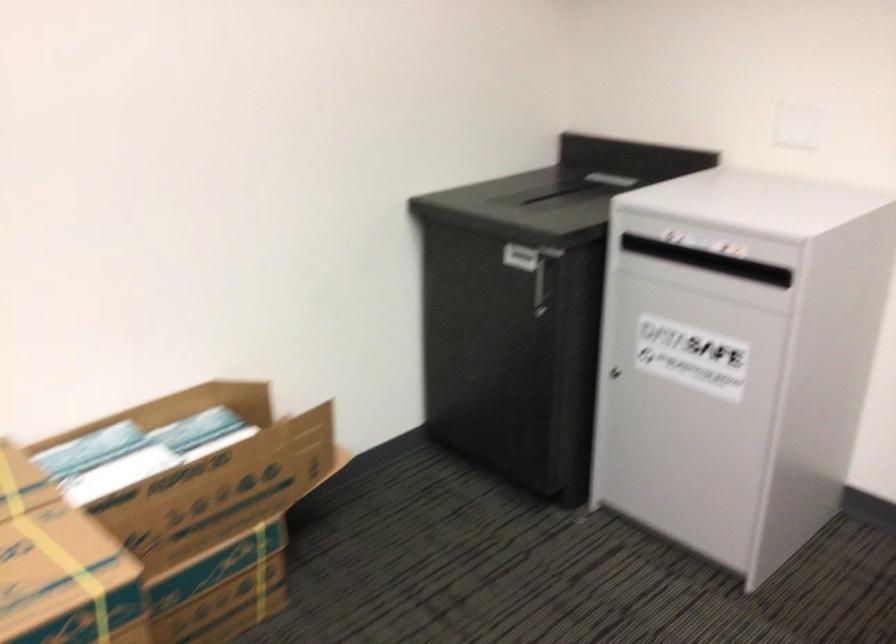
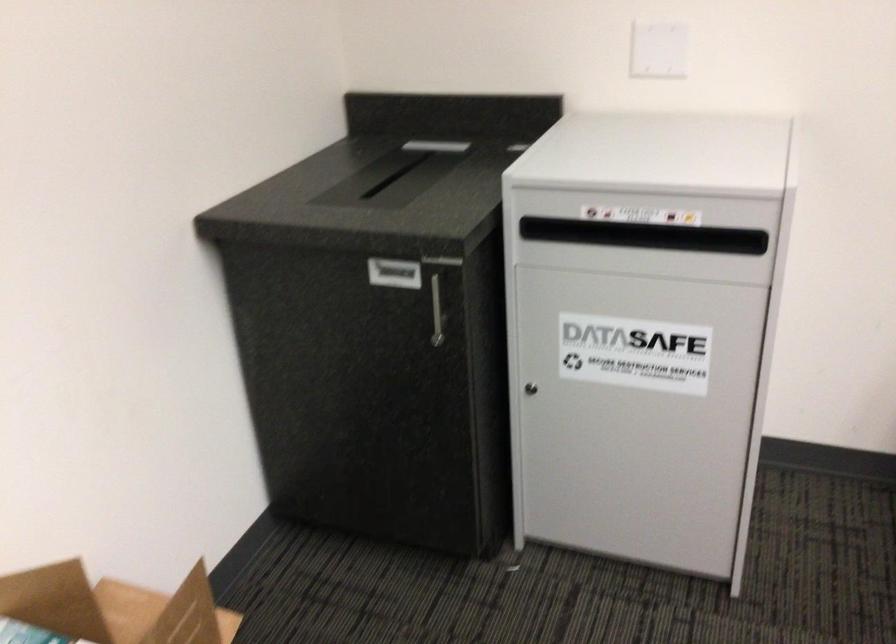
Question: How did the camera likely rotate?

Choices:
 (A) Left
 (B) Right
 (C) Up
 (D) Down

Answer: (B)